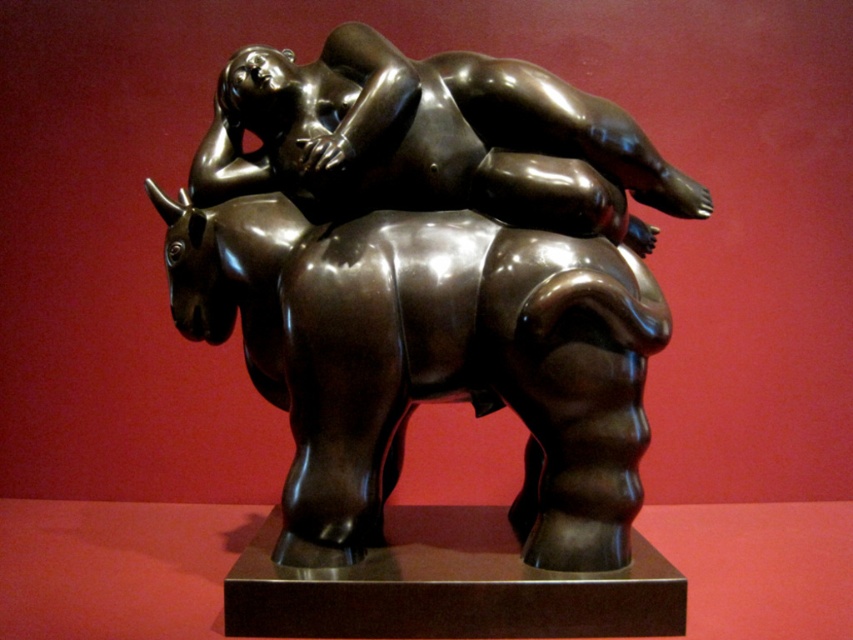
Is the shiny bronze statue at center wider than the bronze figure at center?

The shiny bronze statue at center is wider than the bronze figure at center according to the description.

Looking at the bronze sculpture against the deep red background, you notice two elements at the center. Which one is taller between the shiny bronze statue at center and the bronze figure at center?

The shiny bronze statue at center is much taller than the bronze figure at center.

You are an art conservator examining the bronze sculpture. The museum has a protective glass case that can only accommodate objects within a 0.4 to 0.6 coordinate range on both axes. Is the shiny bronze statue at center positioned safely within this case?

The shiny bronze statue at center is located at point (428, 278), which falls within the 0.4 to 0.6 coordinate range on both axes. Therefore, it is safely positioned within the protective glass case.